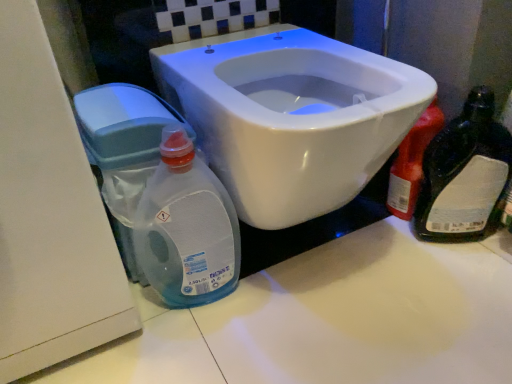
In order to click on vacant space in front of translucent plastic bottle at right in this screenshot , I will do `click(419, 262)`.